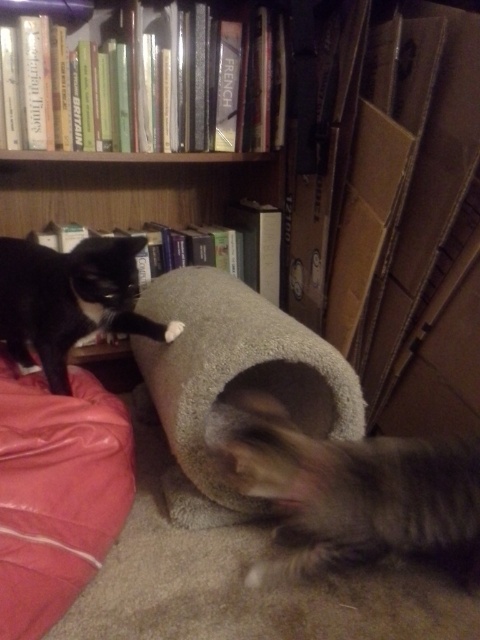
You are a cat owner who wants to buy a new cat bed for your black fur cat at upper left. The current red fabric cat bed at lower left is too small. What is the minimum width you should look for in a new bed?

The red fabric cat bed at lower left has a width less than the black fur cat at upper left. To ensure the new bed is not too small, the minimum width should be at least the width of the black fur cat at upper left.

You are a cat owner who wants to place a new cat toy at the exact center of the room. The room has a coordinate system where the bottom left corner is the origin. The red fabric cat bed at lower left is at point 0.772, 0.119. Where should you place the cat toy to ensure it is exactly at the center of the room?

The center of the room would be at point (240,320). Since the red fabric cat bed at lower left is at (57,493), you should place the cat toy at the center coordinates of (240,320) to ensure it is exactly at the center of the room.

You are standing in a room with a cat bed. The cat bed is at point (237,349). You want to place a new toy that is 1 meter long on the floor. Can you fit the toy horizontally from your current position to the cat bed?

The distance between you and the cat bed at point (237,349) is 92.26 centimeters. Since the toy is 1 meter long, which is longer than the distance, you cannot fit the toy horizontally from your current position to the cat bed.